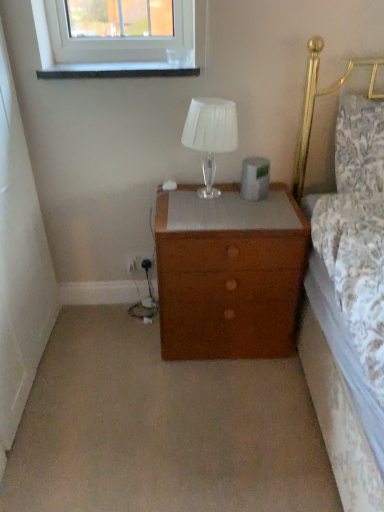
Locate an element on the screen. vacant area that is in front of wooden nightstand at center is located at coordinates (215, 405).